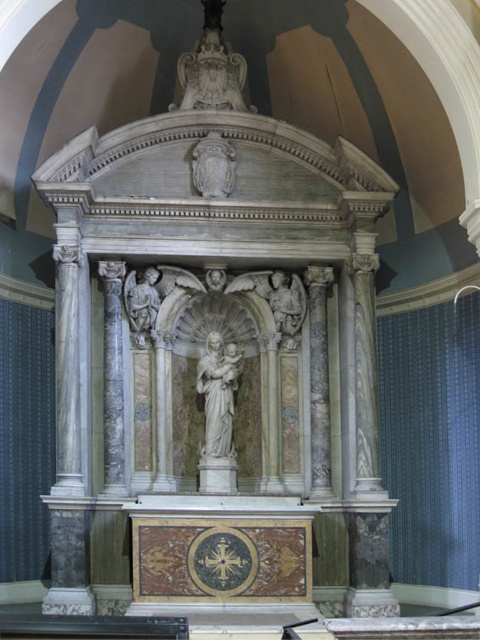
Question: Which object is positioned farthest from the white marble coat of arms at upper center?

Choices:
 (A) white marble angel at upper left
 (B) white marble statue at upper center
 (C) white marble statue at center

Answer: (C)

Question: From the image, what is the correct spatial relationship of white marble statue at upper center in relation to white marble statue at center?

Choices:
 (A) left
 (B) right

Answer: (A)

Question: Among these objects, which one is nearest to the camera?

Choices:
 (A) white marble angel at upper left
 (B) white marble statue at upper center
 (C) white marble statue at center

Answer: (C)

Question: Is the position of white marble statue at center more distant than that of white marble angel at upper left?

Choices:
 (A) no
 (B) yes

Answer: (A)

Question: Among these objects, which one is nearest to the camera?

Choices:
 (A) white marble coat of arms at upper center
 (B) white marble statue at center

Answer: (B)

Question: Does white marble coat of arms at upper center appear over white marble angel at upper left?

Choices:
 (A) no
 (B) yes

Answer: (B)